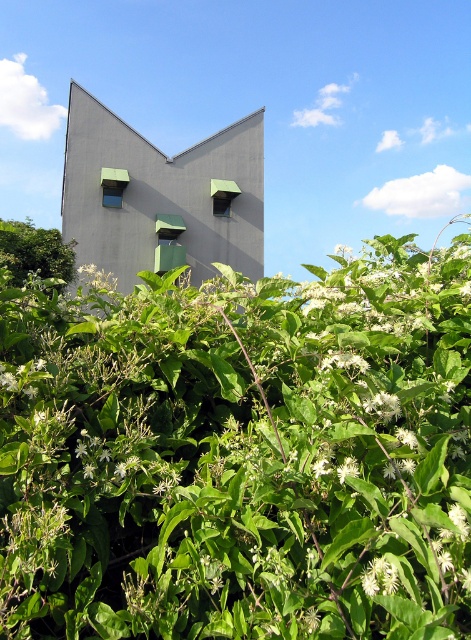
Can you confirm if green leafy hedge at center is positioned below white matte flower at lower center?

No.

Can you confirm if green leafy hedge at center is wider than white matte flower at lower center?

Indeed, green leafy hedge at center has a greater width compared to white matte flower at lower center.

Is point (183, 353) positioned behind point (370, 593)?

Yes, it is.

Find the location of a particular element. green leafy hedge at center is located at coordinates (238, 452).

Who is taller, green leafy hedge at left or white matte flower at lower center?

green leafy hedge at left

Which is in front, point (41, 234) or point (365, 586)?

Point (365, 586) is in front.

Does point (14, 246) lie behind point (372, 582)?

Yes, point (14, 246) is behind point (372, 582).

Locate an element on the screen. Image resolution: width=471 pixels, height=640 pixels. green leafy hedge at left is located at coordinates (34, 252).

Between point (211, 429) and point (48, 260), which one is positioned in front?

Point (211, 429) is in front.

What do you see at coordinates (238, 452) in the screenshot?
I see `green leafy hedge at center` at bounding box center [238, 452].

At what (x,y) coordinates should I click in order to perform the action: click on green leafy hedge at center. Please return your answer as a coordinate pair (x, y). Looking at the image, I should click on (238, 452).